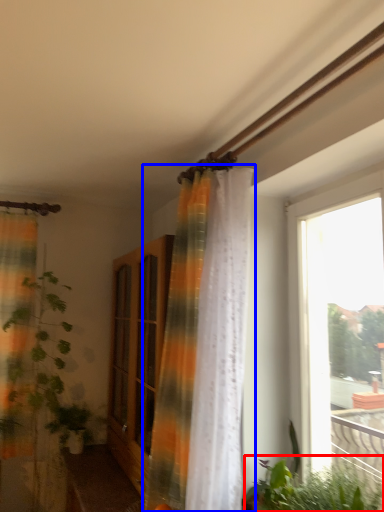
Question: Which of the following is the farthest to the observer, vegetation (highlighted by a red box) or curtain (highlighted by a blue box)?

Choices:
 (A) vegetation
 (B) curtain

Answer: (B)